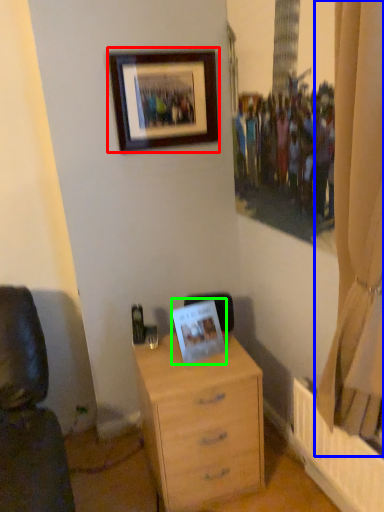
Question: Which object is the farthest from picture frame (highlighted by a red box)? Choose among these: curtain (highlighted by a blue box) or picture frame (highlighted by a green box).

Choices:
 (A) curtain
 (B) picture frame

Answer: (A)